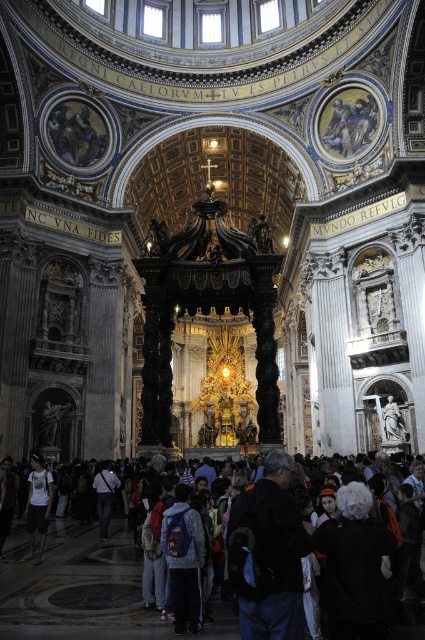
In the scene shown: Can you confirm if dark gray hoodie at lower center is positioned above denim jacket at lower left?

Indeed, dark gray hoodie at lower center is positioned over denim jacket at lower left.

At what (x,y) coordinates should I click in order to perform the action: click on dark gray hoodie at lower center. Please return your answer as a coordinate pair (x, y). Looking at the image, I should click on (356, 566).

You are a GUI agent. You are given a task and a screenshot of the screen. Output one action in this format:
    pyautogui.click(x=<x>, y=<y>)
    Task: Click on the dark gray hoodie at lower center
    
    Given the screenshot: What is the action you would take?
    click(356, 566)

Which is above, dark clothing crowd at lower center or dark gray hoodie at lower center?

dark gray hoodie at lower center is above.

Between dark clothing crowd at lower center and dark gray hoodie at lower center, which one has more height?

With more height is dark gray hoodie at lower center.

What are the coordinates of `dark clothing crowd at lower center` in the screenshot? It's located at (76, 588).

Locate an element on the screen. This screenshot has width=425, height=640. dark clothing crowd at lower center is located at coordinates (76, 588).

Does point (45, 538) come in front of point (95, 483)?

Yes, point (45, 538) is in front of point (95, 483).

Is point (36, 480) positioned before point (110, 467)?

Yes, it is.

Identify the location of white cotton t-shirt at lower left. The width and height of the screenshot is (425, 640). (37, 504).